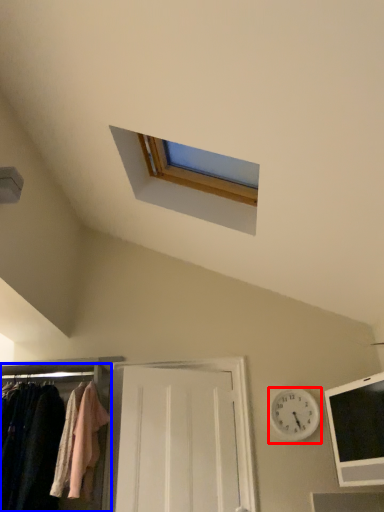
Question: Which object is closer to the camera taking this photo, clock (highlighted by a red box) or closet (highlighted by a blue box)?

Choices:
 (A) clock
 (B) closet

Answer: (B)